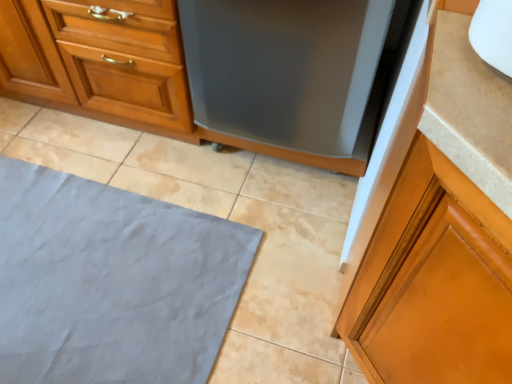
At what (x,y) coordinates should I click in order to perform the action: click on vacant space behind gray fabric bath mat at lower left. Please return your answer as a coordinate pair (x, y). This screenshot has width=512, height=384. Looking at the image, I should click on (122, 156).